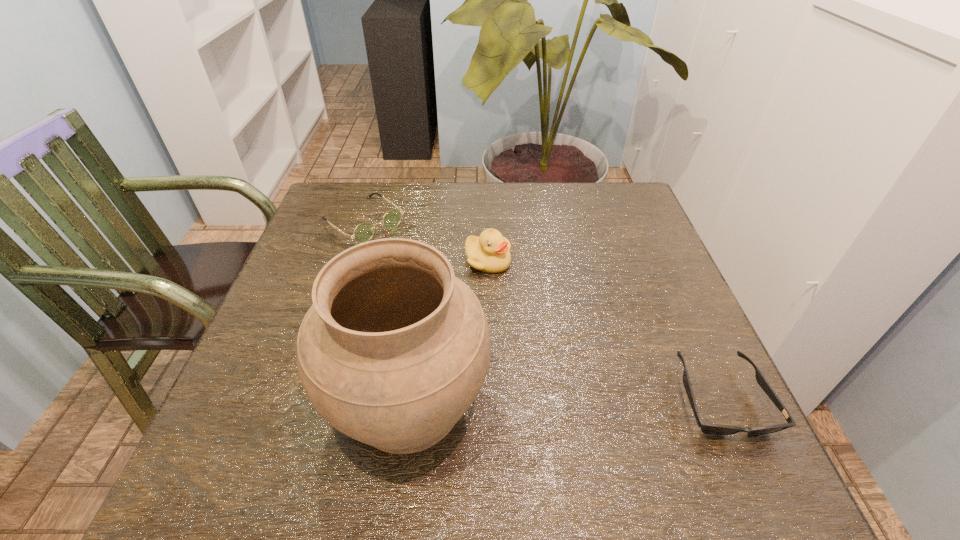
This screenshot has height=540, width=960. Identify the location of vacant area situated on the lenses of the spectacles. (487, 319).

Image resolution: width=960 pixels, height=540 pixels. In order to click on free spot located 0.120m on the lenses of the spectacles in this screenshot , I will do `click(416, 262)`.

The height and width of the screenshot is (540, 960). Find the location of `object that is at the far edge`. object that is at the far edge is located at coordinates coord(364,231).

At what (x,y) coordinates should I click in order to perform the action: click on urn positioned at the near edge. Please return your answer as a coordinate pair (x, y). Looking at the image, I should click on 394,350.

At what (x,y) coordinates should I click in order to perform the action: click on sunglasses situated at the near edge. Please return your answer as a coordinate pair (x, y). Looking at the image, I should click on (714, 429).

The width and height of the screenshot is (960, 540). I want to click on object located in the left edge section of the desktop, so click(x=364, y=231).

Locate an element on the screen. Image resolution: width=960 pixels, height=540 pixels. object located at the right edge is located at coordinates (714, 429).

This screenshot has height=540, width=960. I want to click on object at the far left corner, so click(364, 231).

At what (x,y) coordinates should I click in order to perform the action: click on object that is at the near right corner. Please return your answer as a coordinate pair (x, y). This screenshot has height=540, width=960. Looking at the image, I should click on (714, 429).

Find the location of a particular element. This screenshot has height=540, width=960. vacant position at the far edge of the desktop is located at coordinates (389, 183).